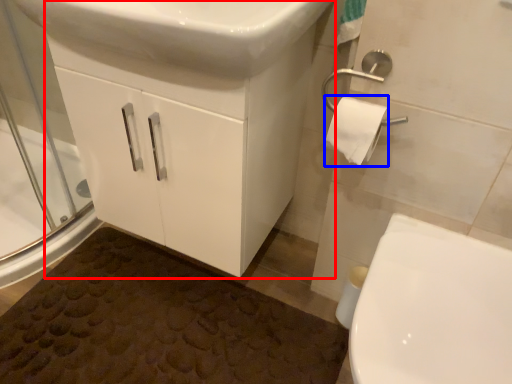
Question: Which of the following is the farthest to the observer, bathroom cabinet (highlighted by a red box) or toilet paper (highlighted by a blue box)?

Choices:
 (A) bathroom cabinet
 (B) toilet paper

Answer: (B)